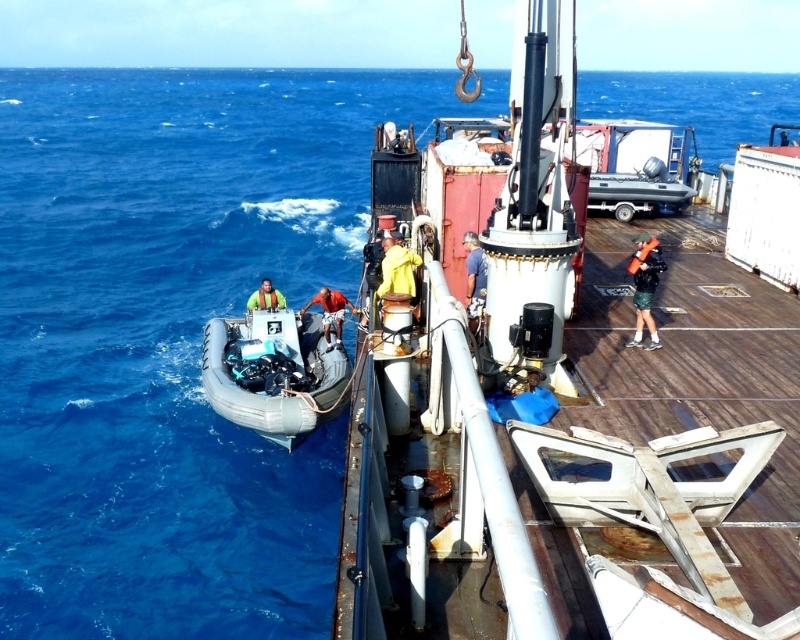
Question: Estimate the real-world distances between objects in this image. Which object is farther from the green fabric life vest at right?

Choices:
 (A) blue fabric shirt at center
 (B) rubberized gray dinghy at lower left

Answer: (B)

Question: Which point is closer to the camera taking this photo?

Choices:
 (A) (222, 330)
 (B) (282, 305)
 (C) (336, 308)
 (D) (476, 296)

Answer: (D)

Question: Estimate the real-world distances between objects in this image. Which object is closer to the yellow life vest at center?

Choices:
 (A) reddish-orange fabric at center
 (B) rubberized gray dinghy at lower left
 (C) green fabric life vest at right
 (D) blue fabric shirt at center

Answer: (B)

Question: Is green fabric life vest at right behind reddish-orange fabric at center?

Choices:
 (A) yes
 (B) no

Answer: (B)

Question: Where is blue fabric shirt at center located in relation to yellow life vest at center in the image?

Choices:
 (A) right
 (B) left

Answer: (A)

Question: Does rubberized gray dinghy at lower left have a lesser width compared to green fabric life vest at right?

Choices:
 (A) no
 (B) yes

Answer: (A)